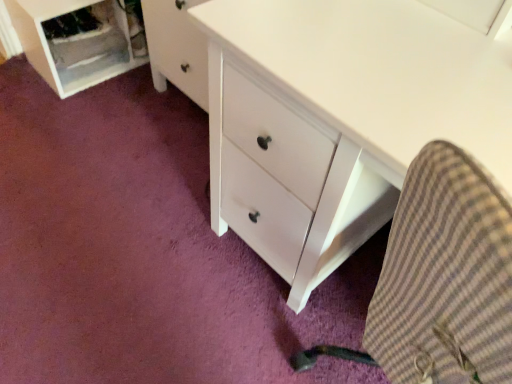
Question: In the image, is brown checkered fabric at lower right positioned in front of or behind white plastic file cabinet at lower left?

Choices:
 (A) front
 (B) behind

Answer: (A)

Question: Considering the positions of brown checkered fabric at lower right and white plastic file cabinet at lower left in the image, is brown checkered fabric at lower right taller or shorter than white plastic file cabinet at lower left?

Choices:
 (A) short
 (B) tall

Answer: (B)

Question: From a real-world perspective, is brown checkered fabric at lower right physically located above or below white plastic file cabinet at lower left?

Choices:
 (A) below
 (B) above

Answer: (B)

Question: Relative to brown checkered fabric at lower right, is white plastic file cabinet at lower left in front or behind?

Choices:
 (A) front
 (B) behind

Answer: (B)

Question: Choose the correct answer: Is white plastic file cabinet at lower left inside brown checkered fabric at lower right or outside it?

Choices:
 (A) outside
 (B) inside

Answer: (A)

Question: Is white plastic file cabinet at lower left wider or thinner than brown checkered fabric at lower right?

Choices:
 (A) thin
 (B) wide

Answer: (A)

Question: Is white plastic file cabinet at lower left bigger or smaller than brown checkered fabric at lower right?

Choices:
 (A) small
 (B) big

Answer: (A)